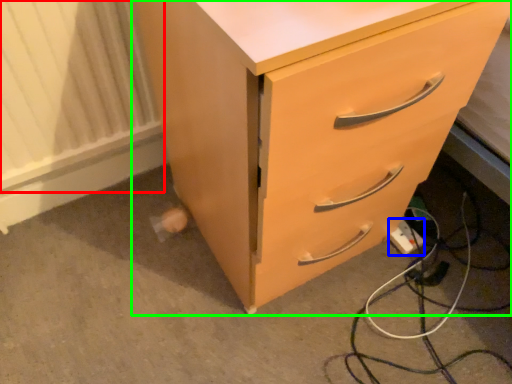
Question: Based on their relative distances, which object is nearer to radiator (highlighted by a red box)? Choose from extension cord (highlighted by a blue box) and chest of drawers (highlighted by a green box).

Choices:
 (A) extension cord
 (B) chest of drawers

Answer: (B)